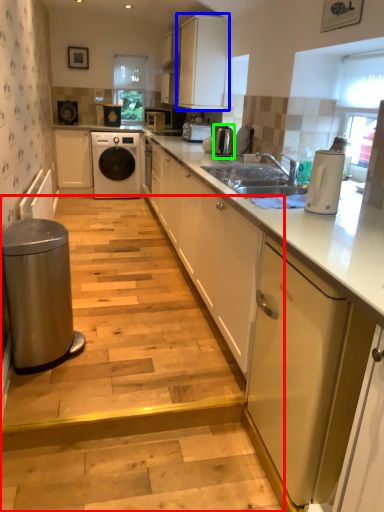
Question: Based on their relative distances, which object is nearer to stair (highlighted by a red box)? Choose from cabinetry (highlighted by a blue box) and kitchen appliance (highlighted by a green box).

Choices:
 (A) cabinetry
 (B) kitchen appliance

Answer: (B)